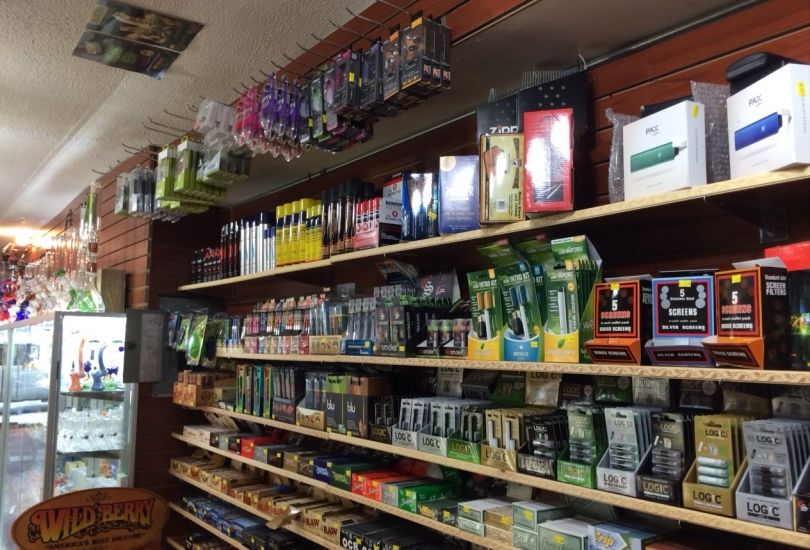
Locate an element on the screen. This screenshot has width=810, height=550. glass is located at coordinates (35, 379).